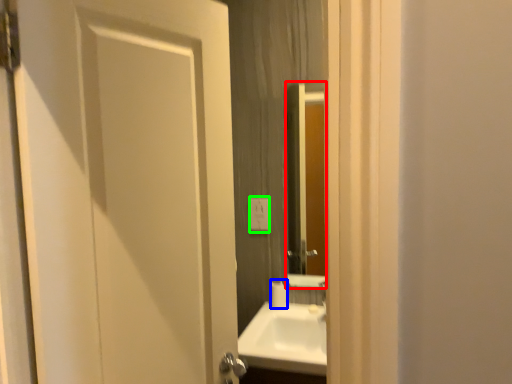
Question: Considering the real-world distances, which object is farthest from mirror (highlighted by a red box)? toilet paper (highlighted by a blue box) or electric outlet (highlighted by a green box)?

Choices:
 (A) toilet paper
 (B) electric outlet

Answer: (A)